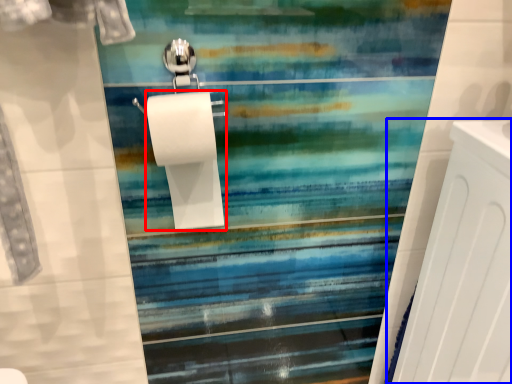
Question: Which object is closer to the camera taking this photo, toilet paper (highlighted by a red box) or radiator (highlighted by a blue box)?

Choices:
 (A) toilet paper
 (B) radiator

Answer: (B)